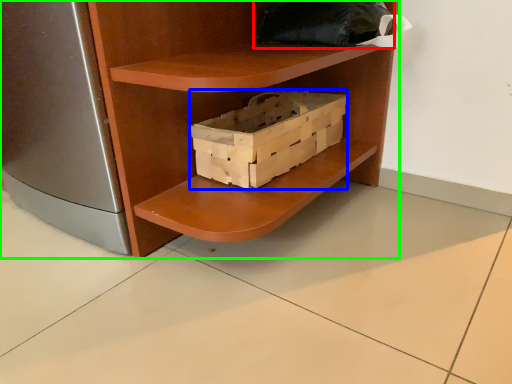
Question: Which is nearer to the pillow (highlighted by a red box)? box (highlighted by a blue box) or shelf (highlighted by a green box).

Choices:
 (A) box
 (B) shelf

Answer: (A)